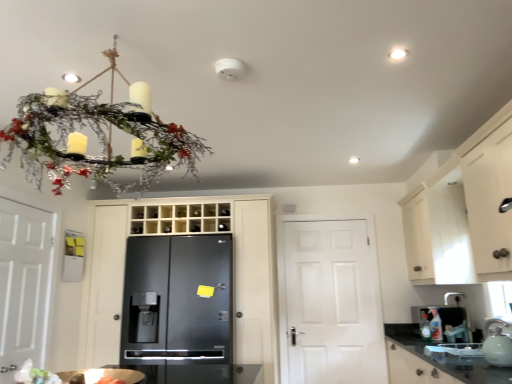
Question: Is matte white chandelier at upper left beside black matte refrigerator at center?

Choices:
 (A) yes
 (B) no

Answer: (B)

Question: Would you say matte white chandelier at upper left contains black matte refrigerator at center?

Choices:
 (A) yes
 (B) no

Answer: (B)

Question: Is matte white chandelier at upper left further to camera compared to black matte refrigerator at center?

Choices:
 (A) yes
 (B) no

Answer: (B)

Question: Can you confirm if matte white chandelier at upper left is wider than black matte refrigerator at center?

Choices:
 (A) yes
 (B) no

Answer: (B)

Question: Is matte white chandelier at upper left thinner than black matte refrigerator at center?

Choices:
 (A) no
 (B) yes

Answer: (B)

Question: Looking at their shapes, would you say matte white chandelier at upper left is wider or thinner than black granite countertop at lower right?

Choices:
 (A) thin
 (B) wide

Answer: (B)

Question: In terms of height, does matte white chandelier at upper left look taller or shorter compared to black granite countertop at lower right?

Choices:
 (A) short
 (B) tall

Answer: (B)

Question: From a real-world perspective, is matte white chandelier at upper left physically located above or below black granite countertop at lower right?

Choices:
 (A) above
 (B) below

Answer: (A)

Question: Looking at the image, does matte white chandelier at upper left seem bigger or smaller compared to black granite countertop at lower right?

Choices:
 (A) big
 (B) small

Answer: (B)

Question: From their relative heights in the image, would you say white matte door at center, marked as the 3th door in a left-to-right arrangement, is taller or shorter than matte white chandelier at upper left?

Choices:
 (A) short
 (B) tall

Answer: (B)

Question: Considering the relative positions of white matte door at center, marked as the 3th door in a left-to-right arrangement, and matte white chandelier at upper left in the image provided, is white matte door at center, marked as the 3th door in a left-to-right arrangement, to the left or to the right of matte white chandelier at upper left?

Choices:
 (A) left
 (B) right

Answer: (B)

Question: In the image, is white matte door at center, marked as the first door in a right-to-left arrangement, positioned in front of or behind matte white chandelier at upper left?

Choices:
 (A) front
 (B) behind

Answer: (B)

Question: In terms of width, does white matte door at center, marked as the 3th door in a left-to-right arrangement, look wider or thinner when compared to matte white chandelier at upper left?

Choices:
 (A) wide
 (B) thin

Answer: (B)

Question: Is point (497, 359) positioned closer to the camera than point (186, 211)?

Choices:
 (A) farther
 (B) closer

Answer: (B)

Question: From a real-world perspective, is white glossy tea pot at lower right physically located above or below glossy black refrigerator at center, marked as the second door in a left-to-right arrangement?

Choices:
 (A) below
 (B) above

Answer: (A)